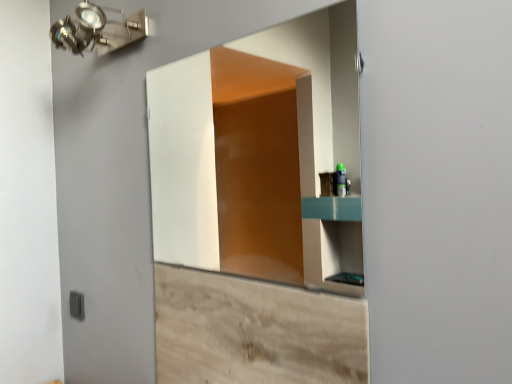
Question: From a real-world perspective, does wooden cabinet at lower center stand above matte glass mirror at center?

Choices:
 (A) yes
 (B) no

Answer: (B)

Question: From the image's perspective, is wooden cabinet at lower center located above matte glass mirror at center?

Choices:
 (A) no
 (B) yes

Answer: (A)

Question: Can you confirm if wooden cabinet at lower center is thinner than matte glass mirror at center?

Choices:
 (A) no
 (B) yes

Answer: (B)

Question: Can you confirm if wooden cabinet at lower center is smaller than matte glass mirror at center?

Choices:
 (A) no
 (B) yes

Answer: (B)

Question: Is wooden cabinet at lower center further to camera compared to matte glass mirror at center?

Choices:
 (A) no
 (B) yes

Answer: (A)

Question: Does wooden cabinet at lower center have a greater width compared to matte glass mirror at center?

Choices:
 (A) yes
 (B) no

Answer: (B)

Question: Is the depth of gray plastic light switch at lower left less than that of matte glass mirror at center?

Choices:
 (A) yes
 (B) no

Answer: (B)

Question: Considering the relative sizes of gray plastic light switch at lower left and matte glass mirror at center in the image provided, is gray plastic light switch at lower left taller than matte glass mirror at center?

Choices:
 (A) yes
 (B) no

Answer: (B)

Question: From the image's perspective, does gray plastic light switch at lower left appear higher than matte glass mirror at center?

Choices:
 (A) yes
 (B) no

Answer: (B)

Question: Can you confirm if gray plastic light switch at lower left is bigger than matte glass mirror at center?

Choices:
 (A) no
 (B) yes

Answer: (A)

Question: Would you say gray plastic light switch at lower left is a long distance from matte glass mirror at center?

Choices:
 (A) yes
 (B) no

Answer: (A)

Question: Could you tell me if gray plastic light switch at lower left is facing matte glass mirror at center?

Choices:
 (A) yes
 (B) no

Answer: (B)

Question: Is the position of matte glass mirror at center more distant than that of wooden cabinet at lower center?

Choices:
 (A) no
 (B) yes

Answer: (B)